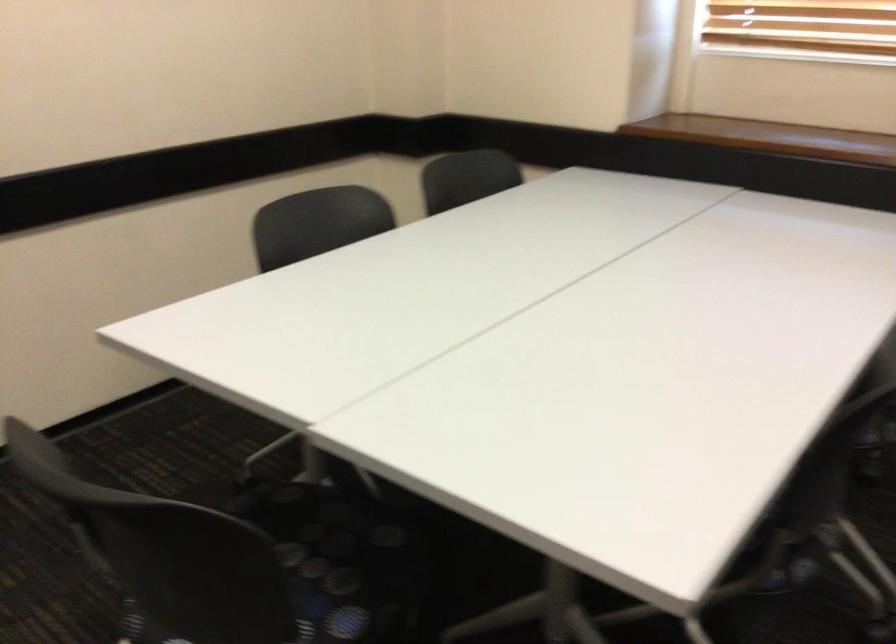
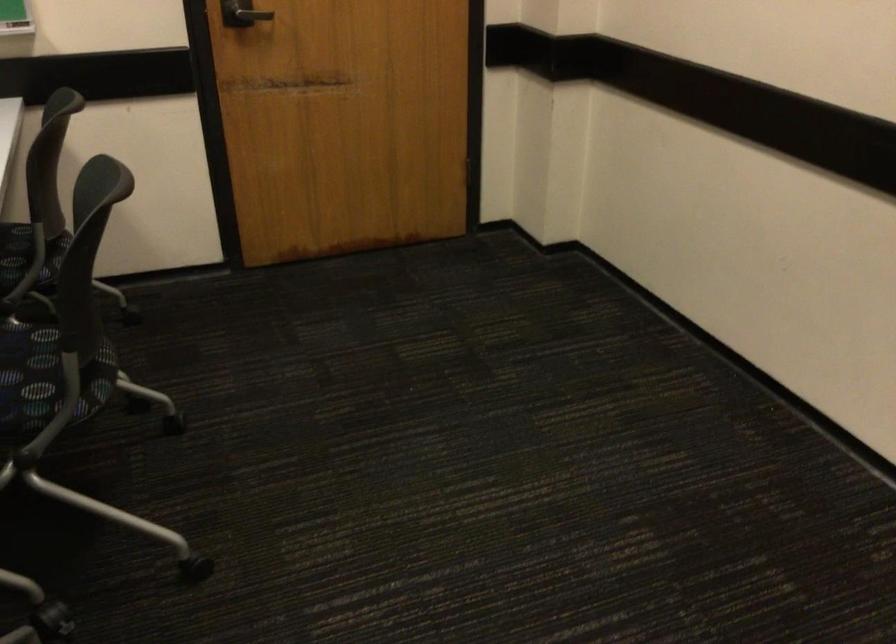
How did the camera likely rotate?

The camera's rotation is toward left-down.